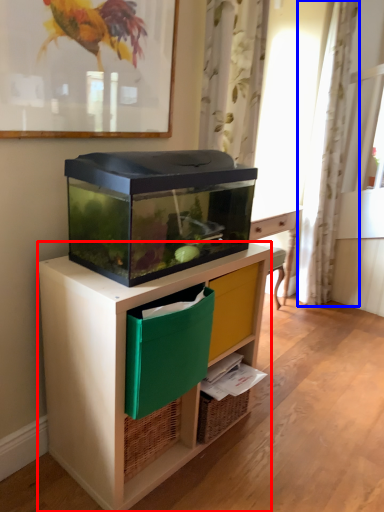
Question: Which object is further to the camera taking this photo, desk (highlighted by a red box) or curtain (highlighted by a blue box)?

Choices:
 (A) desk
 (B) curtain

Answer: (B)